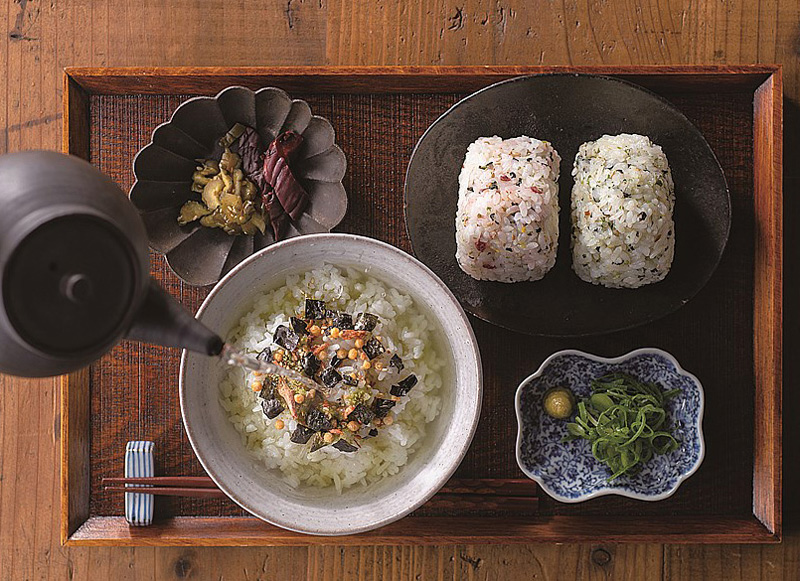
Locate an element on the screen. This screenshot has width=800, height=581. tray is located at coordinates (392, 86), (480, 523), (73, 393).